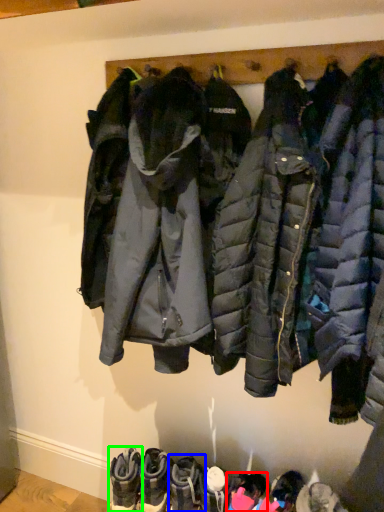
Question: Which is farther away from footwear (highlighted by a red box)? footwear (highlighted by a blue box) or footwear (highlighted by a green box)?

Choices:
 (A) footwear
 (B) footwear

Answer: (B)